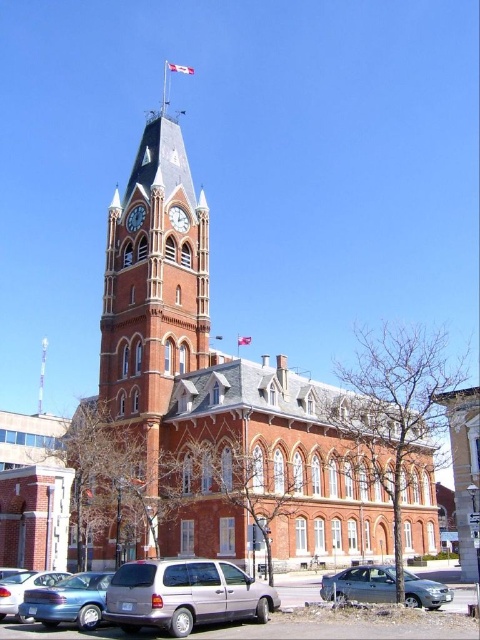
Can you confirm if metallic blue sedan at lower left is positioned above matte red brick clock tower at upper center?

No, metallic blue sedan at lower left is not above matte red brick clock tower at upper center.

Measure the distance from metallic blue sedan at lower left to matte red brick clock tower at upper center.

39.50 meters

Between point (37, 586) and point (139, 227), which one is positioned behind?

Positioned behind is point (139, 227).

At what (x,y) coordinates should I click in order to perform the action: click on metallic blue sedan at lower left. Please return your answer as a coordinate pair (x, y). Looking at the image, I should click on (24, 588).

Which of these two, metallic silver minivan at lower center or matte red brick clock tower at upper center, stands taller?

With more height is metallic silver minivan at lower center.

Does metallic silver minivan at lower center appear on the right side of matte red brick clock tower at upper center?

Correct, you'll find metallic silver minivan at lower center to the right of matte red brick clock tower at upper center.

Where is `metallic silver minivan at lower center`? The height and width of the screenshot is (640, 480). metallic silver minivan at lower center is located at coordinates (184, 595).

Can you confirm if metallic gray sedan at lower center is positioned to the right of matte blue sedan at lower left?

Yes, metallic gray sedan at lower center is to the right of matte blue sedan at lower left.

Is metallic gray sedan at lower center further to camera compared to matte blue sedan at lower left?

Yes, metallic gray sedan at lower center is behind matte blue sedan at lower left.

The image size is (480, 640). What are the coordinates of `metallic gray sedan at lower center` in the screenshot? It's located at (360, 584).